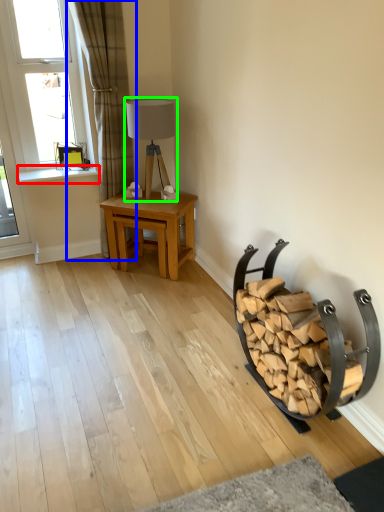
Question: Which object is positioned closest to window sill (highlighted by a red box)? Select from curtain (highlighted by a blue box) and table lamp (highlighted by a green box).

Choices:
 (A) curtain
 (B) table lamp

Answer: (A)